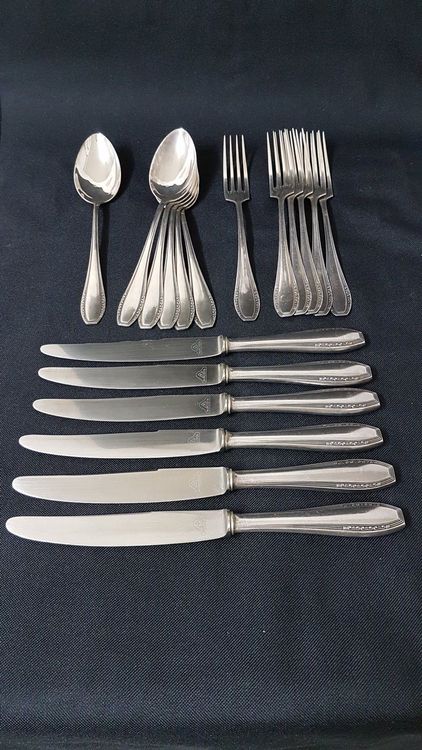
Locate an element on the screen. This screenshot has height=750, width=422. spoons is located at coordinates (95, 296), (133, 298), (151, 300), (170, 301), (184, 301), (202, 303).